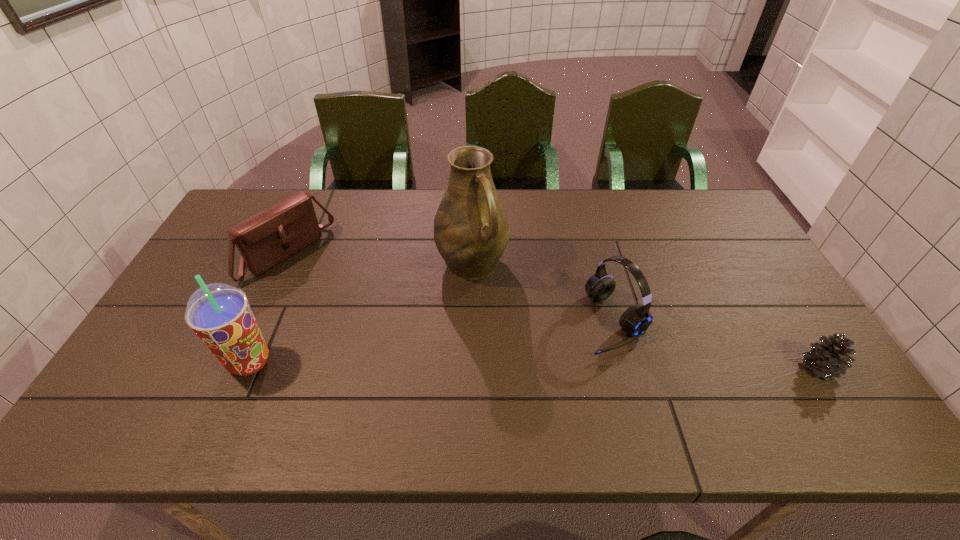
Identify the location of vacant space on the desktop that is between the smoothie and the shortest object and is positioned on the ear cushions of the fourth object from left to right. (530, 365).

Find the location of `vacant spot on the desktop that is between the smoothie and the pinecone and is positioned on the handle side of the third object from right to left`. vacant spot on the desktop that is between the smoothie and the pinecone and is positioned on the handle side of the third object from right to left is located at coordinates (540, 365).

Identify the location of vacant space on the desktop that is between the fourth shortest object and the pinecone and is positioned on the front flap of the shoulder bag. The height and width of the screenshot is (540, 960). (452, 364).